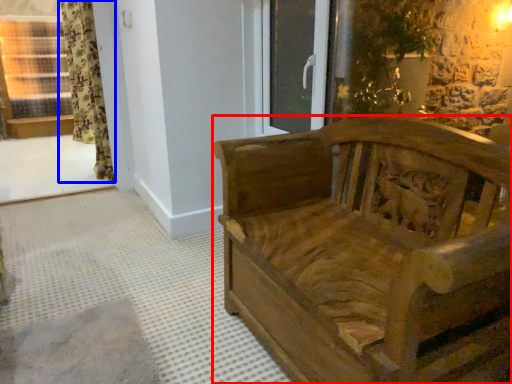
Question: Which object is closer to the camera taking this photo, furniture (highlighted by a red box) or curtain (highlighted by a blue box)?

Choices:
 (A) furniture
 (B) curtain

Answer: (A)